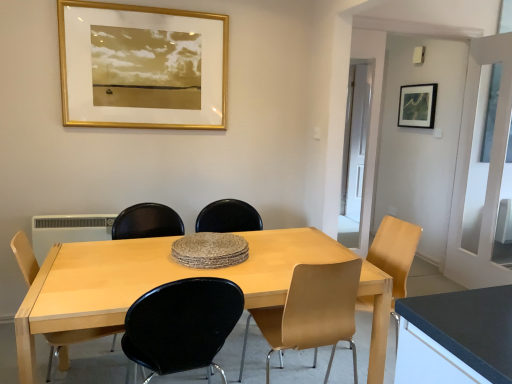
Looking at this image, measure the distance between black leather chair at center, arranged as the third chair when viewed from the right, and camera.

black leather chair at center, arranged as the third chair when viewed from the right, is 4.66 feet from camera.

How much space does matte black picture frame at upper right, which is counted as the 1th picture frame, starting from the right, occupy horizontally?

matte black picture frame at upper right, which is counted as the 1th picture frame, starting from the right, is 2.15 inches in width.

Where is `white glossy door at center`? The image size is (512, 384). white glossy door at center is located at coordinates (420, 140).

Is light brown wood chair at lower left, the fourth chair in the right-to-left sequence, not close to light brown wood chair at center, marked as the third chair in a left-to-right arrangement?

Yes, light brown wood chair at lower left, the fourth chair in the right-to-left sequence, is far from light brown wood chair at center, marked as the third chair in a left-to-right arrangement.

Does light brown wood chair at lower left, which appears as the 1th chair when viewed from the left, have a smaller size compared to light brown wood chair at center, the 2th chair when ordered from right to left?

Indeed, light brown wood chair at lower left, which appears as the 1th chair when viewed from the left, has a smaller size compared to light brown wood chair at center, the 2th chair when ordered from right to left.

Considering the positions of objects light brown wood chair at lower left, the fourth chair in the right-to-left sequence, and light brown wood chair at center, the 2th chair when ordered from right to left, in the image provided, who is more to the left, light brown wood chair at lower left, the fourth chair in the right-to-left sequence, or light brown wood chair at center, the 2th chair when ordered from right to left,?

From the viewer's perspective, light brown wood chair at lower left, the fourth chair in the right-to-left sequence, appears more on the left side.

From a real-world perspective, who is located lower, light wood table at center or white plastic radiator at lower left?

In real-world perspective, light wood table at center is lower.

Are light wood table at center and white plastic radiator at lower left located far from each other?

No, there isn't a large distance between light wood table at center and white plastic radiator at lower left.

Considering the relative positions of light wood table at center and white plastic radiator at lower left in the image provided, is light wood table at center to the right of white plastic radiator at lower left from the viewer's perspective?

Indeed, light wood table at center is positioned on the right side of white plastic radiator at lower left.

Visually, is white glossy door at center positioned to the left or to the right of gold/gilded picture frame at upper center, which is the first picture frame in front-to-back order?

white glossy door at center is positioned on gold/gilded picture frame at upper center, which is the first picture frame in front-to-back order,'s right side.

From a real-world perspective, is white glossy door at center physically located above or below gold/gilded picture frame at upper center, which is the first picture frame in front-to-back order?

white glossy door at center is below gold/gilded picture frame at upper center, which is the first picture frame in front-to-back order.

Is white glossy door at center aimed at gold/gilded picture frame at upper center, the second picture frame when ordered from right to left?

No, white glossy door at center is not facing towards gold/gilded picture frame at upper center, the second picture frame when ordered from right to left.

The image size is (512, 384). What are the coordinates of `door directly beneath the gold/gilded picture frame at upper center, acting as the 2th picture frame starting from the back (from a real-world perspective)` in the screenshot? It's located at (420, 140).

Consider the image. Considering the sizes of objects matte yellow chair at right, the 1th chair in the right-to-left sequence, and matte black chair at center, which is the second armchair from right to left, in the image provided, who is smaller, matte yellow chair at right, the 1th chair in the right-to-left sequence, or matte black chair at center, which is the second armchair from right to left,?

matte black chair at center, which is the second armchair from right to left.

From the image's perspective, who appears lower, matte yellow chair at right, the fourth chair positioned from the left, or matte black chair at center, which is the second armchair from right to left?

matte yellow chair at right, the fourth chair positioned from the left.

Considering the sizes of objects matte yellow chair at right, the 1th chair in the right-to-left sequence, and matte black chair at center, which appears as the first armchair when viewed from the left, in the image provided, who is wider, matte yellow chair at right, the 1th chair in the right-to-left sequence, or matte black chair at center, which appears as the first armchair when viewed from the left,?

matte black chair at center, which appears as the first armchair when viewed from the left.

From a real-world perspective, is light brown wood chair at lower left, the fourth chair in the right-to-left sequence, positioned under gold/gilded picture frame at upper center, the second picture frame when ordered from right to left, based on gravity?

Correct, in the physical world, light brown wood chair at lower left, the fourth chair in the right-to-left sequence, is lower than gold/gilded picture frame at upper center, the second picture frame when ordered from right to left.

Is point (113, 342) positioned after point (162, 101)?

No.

Is light brown wood chair at lower left, which appears as the 1th chair when viewed from the left, completely or partially outside of gold/gilded picture frame at upper center, the second picture frame when ordered from right to left?

That's correct, light brown wood chair at lower left, which appears as the 1th chair when viewed from the left, is outside of gold/gilded picture frame at upper center, the second picture frame when ordered from right to left.

From a real-world perspective, is matte yellow chair at right, the 1th chair in the right-to-left sequence, located higher than white plastic radiator at lower left?

Incorrect, from a real-world perspective, matte yellow chair at right, the 1th chair in the right-to-left sequence, is lower than white plastic radiator at lower left.

In terms of width, does matte yellow chair at right, the 1th chair in the right-to-left sequence, look wider or thinner when compared to white plastic radiator at lower left?

In the image, matte yellow chair at right, the 1th chair in the right-to-left sequence, appears to be wider than white plastic radiator at lower left.

I want to click on chair that is the 1st one when counting forward from the white plastic radiator at lower left, so click(x=395, y=255).

Which is less distant, (429, 103) or (84, 341)?

The point (84, 341) is in front.

Considering the relative positions of matte black picture frame at upper right, which is counted as the 1th picture frame, starting from the right, and light brown wood chair at lower left, the fourth chair in the right-to-left sequence, in the image provided, is matte black picture frame at upper right, which is counted as the 1th picture frame, starting from the right, in front of light brown wood chair at lower left, the fourth chair in the right-to-left sequence,?

No, it is behind light brown wood chair at lower left, the fourth chair in the right-to-left sequence.

Does matte black picture frame at upper right, arranged as the 2th picture frame when viewed from the front, have a greater height compared to light brown wood chair at lower left, which appears as the 1th chair when viewed from the left?

No.

Can we say matte black picture frame at upper right, the second picture frame when ordered from left to right, lies outside light brown wood chair at lower left, which appears as the 1th chair when viewed from the left?

matte black picture frame at upper right, the second picture frame when ordered from left to right, is positioned outside light brown wood chair at lower left, which appears as the 1th chair when viewed from the left.

What are the coordinates of `chair that is the 1st one when counting forward from the light brown wood chair at lower left, the fourth chair in the right-to-left sequence` in the screenshot? It's located at (312, 312).

I want to click on table below the white plastic radiator at lower left (from the image's perspective), so coord(151,280).

Based on their spatial positions, is matte yellow chair at right, the fourth chair positioned from the left, or matte black chair at center, which is the 2th armchair from left to right, further from black leather chair at center, arranged as the third chair when viewed from the right?

matte black chair at center, which is the 2th armchair from left to right, lies further to black leather chair at center, arranged as the third chair when viewed from the right, than the other object.

Considering their positions, is white glossy door at center positioned closer to light brown wood chair at center, marked as the third chair in a left-to-right arrangement, than gold/gilded picture frame at upper center, the 1th picture frame when ordered from left to right?

gold/gilded picture frame at upper center, the 1th picture frame when ordered from left to right, is closer to light brown wood chair at center, marked as the third chair in a left-to-right arrangement.

Based on the photo, from the image, which object appears to be nearer to matte black chair at center, which is the second armchair from right to left, gold/gilded picture frame at upper center, acting as the 2th picture frame starting from the back, or matte black chair at center, which appears as the first armchair when viewed from the right?

matte black chair at center, which appears as the first armchair when viewed from the right.

Which object lies further to the anchor point black leather chair at center, arranged as the third chair when viewed from the right, matte black chair at center, which is the second armchair from right to left, or matte black picture frame at upper right, which is counted as the 1th picture frame, starting from the right?

matte black picture frame at upper right, which is counted as the 1th picture frame, starting from the right.

Looking at the image, which one is located closer to black leather chair at center, positioned as the second chair in left-to-right order, white plastic radiator at lower left or light brown wood chair at lower left, which appears as the 1th chair when viewed from the left?

light brown wood chair at lower left, which appears as the 1th chair when viewed from the left.

Based on their spatial positions, is gold/gilded picture frame at upper center, the second picture frame when ordered from right to left, or light brown wood chair at center, marked as the third chair in a left-to-right arrangement, further from matte yellow chair at right, the 1th chair in the right-to-left sequence?

The object further to matte yellow chair at right, the 1th chair in the right-to-left sequence, is gold/gilded picture frame at upper center, the second picture frame when ordered from right to left.

In the scene shown: Which object lies nearer to the anchor point white plastic radiator at lower left, white glossy door at center or black leather chair at center, arranged as the third chair when viewed from the right?

black leather chair at center, arranged as the third chair when viewed from the right, lies closer to white plastic radiator at lower left than the other object.

Estimate the real-world distances between objects in this image. Which object is further from gold/gilded picture frame at upper center, the 1th picture frame when ordered from left to right, light brown wood chair at lower left, which appears as the 1th chair when viewed from the left, or matte black chair at center, which is the 2th armchair from left to right?

light brown wood chair at lower left, which appears as the 1th chair when viewed from the left, is positioned further to the anchor gold/gilded picture frame at upper center, the 1th picture frame when ordered from left to right.

Find the location of a particular element. The width and height of the screenshot is (512, 384). chair between matte black chair at center, which appears as the first armchair when viewed from the left, and light brown wood chair at center, the 2th chair when ordered from right to left, in the horizontal direction is located at coordinates (182, 325).

Identify the location of door located between gold/gilded picture frame at upper center, which is the first picture frame in front-to-back order, and matte black picture frame at upper right, the second picture frame when ordered from left to right, in the left-right direction. The width and height of the screenshot is (512, 384). (420, 140).

Where is `table between black leather chair at center, positioned as the second chair in left-to-right order, and white plastic radiator at lower left in the front-back direction`? table between black leather chair at center, positioned as the second chair in left-to-right order, and white plastic radiator at lower left in the front-back direction is located at coordinates (151, 280).

I want to click on table between black leather chair at center, arranged as the third chair when viewed from the right, and light brown wood chair at center, marked as the third chair in a left-to-right arrangement, so click(151, 280).